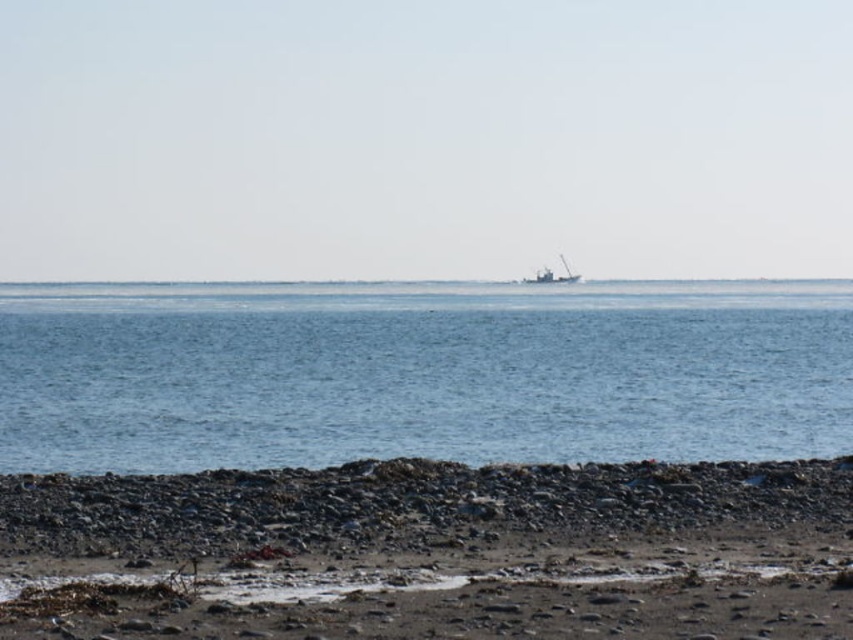
Question: Observing the image, what is the correct spatial positioning of smooth pebbles at lower center in reference to metallic gray boat at center?

Choices:
 (A) below
 (B) above

Answer: (A)

Question: Estimate the real-world distances between objects in this image. Which object is closer to the metallic gray boat at center?

Choices:
 (A) blue water at center
 (B) smooth pebbles at lower center

Answer: (A)

Question: Which is farther from the blue water at center?

Choices:
 (A) smooth pebbles at lower center
 (B) metallic gray boat at center

Answer: (B)

Question: Among these points, which one is farthest from the camera?

Choices:
 (A) coord(581,468)
 (B) coord(164,296)
 (C) coord(554,276)

Answer: (C)

Question: Is blue water at center bigger than metallic gray boat at center?

Choices:
 (A) no
 (B) yes

Answer: (B)

Question: Does blue water at center appear on the left side of smooth pebbles at lower center?

Choices:
 (A) no
 (B) yes

Answer: (B)